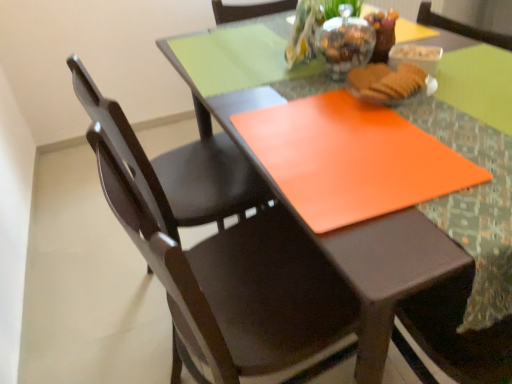
Where is `empty space that is ontop of orange matte placemat at center (from a real-world perspective)`? empty space that is ontop of orange matte placemat at center (from a real-world perspective) is located at coordinates (343, 144).